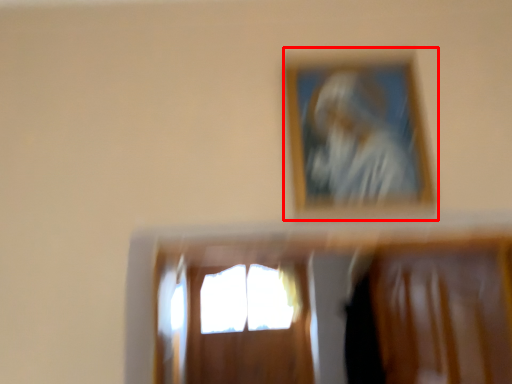
Question: From the image's perspective, what is the correct spatial relationship of picture frame (annotated by the red box) in relation to window?

Choices:
 (A) above
 (B) below

Answer: (A)